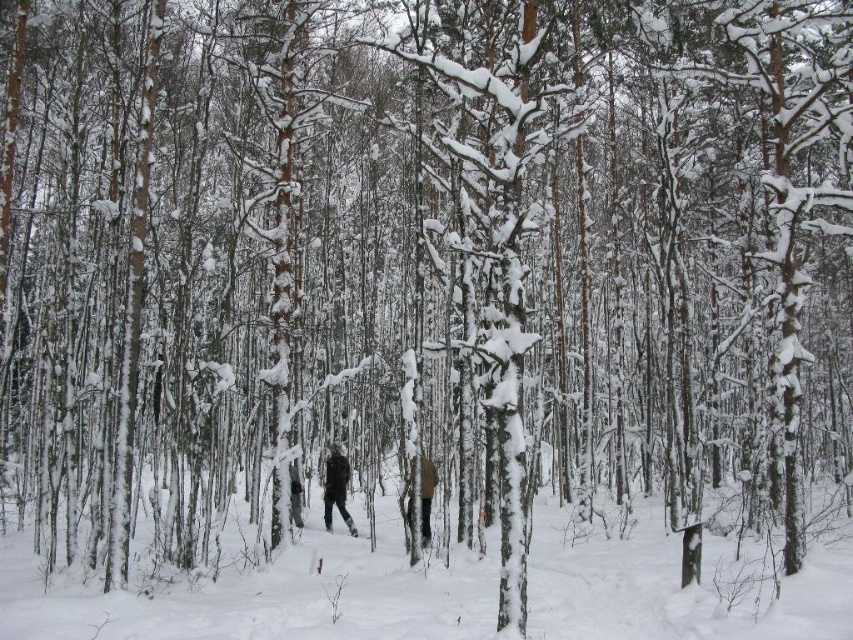
You are an observer in the winter forest scene. You notice two people wearing the dark gray ski suit at center and the brown woolen jacket at center. Which person appears to be bigger in size?

The dark gray ski suit at center is larger in size than the brown woolen jacket at center, so the person wearing the dark gray ski suit at center appears bigger in size.

You are a hiker who wants to place a small marker between the white powdery snow at center and the dark gray ski suit at center. If the marker is 2 meters long, will it fit between them without overlapping either object?

The distance between the white powdery snow at center and the dark gray ski suit at center is 7.35 meters. Since the marker is only 2 meters long, it will fit comfortably between them without overlapping either object.

You are standing in the winter forest and see the white powdery snow at center and the brown woolen jacket at center. Which object is nearer to you?

The white powdery snow at center is closer to the viewer than the brown woolen jacket at center.